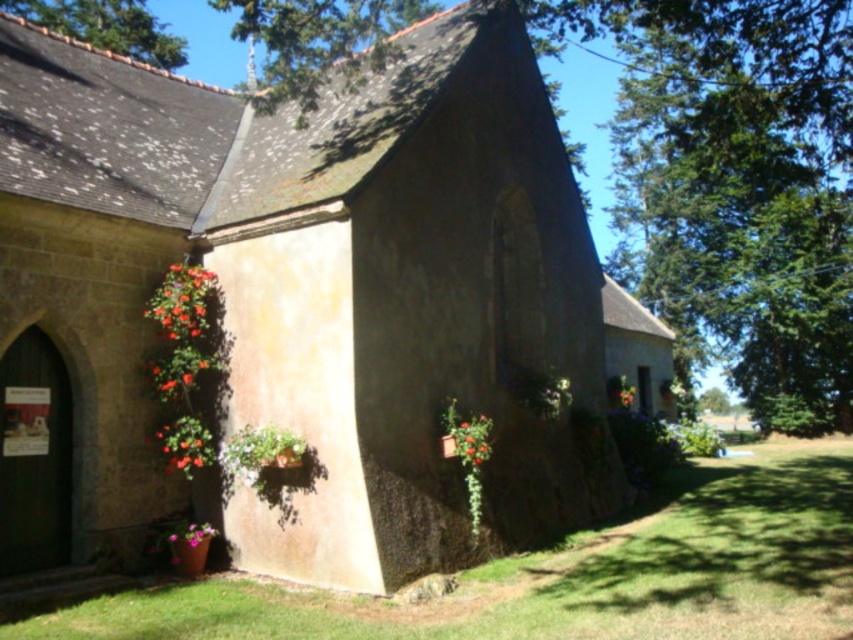
At what (x,y) coordinates should I click in order to perform the action: click on green leafy tree at upper left. Please return your answer as a coordinate pair (x, y). The image size is (853, 640). Looking at the image, I should click on (x=106, y=26).

Does green leafy tree at upper left have a greater height compared to matte red flower at lower left?

Correct, green leafy tree at upper left is much taller as matte red flower at lower left.

Where is `green leafy tree at upper left`? green leafy tree at upper left is located at coordinates (106, 26).

Between point (531, 166) and point (194, 280), which one is positioned behind?

The point (531, 166) is more distant.

Between point (267, 400) and point (175, 269), which one is positioned behind?

The point (175, 269) is behind.

Find the location of a particular element. This screenshot has width=853, height=640. smooth stone chapel at center is located at coordinates (315, 291).

What do you see at coordinates (106, 26) in the screenshot? I see `green leafy tree at upper left` at bounding box center [106, 26].

Is point (132, 13) less distant than point (177, 540)?

No.

Describe the element at coordinates (106, 26) in the screenshot. This screenshot has height=640, width=853. I see `green leafy tree at upper left` at that location.

The width and height of the screenshot is (853, 640). Find the location of `green leafy tree at upper left`. green leafy tree at upper left is located at coordinates (106, 26).